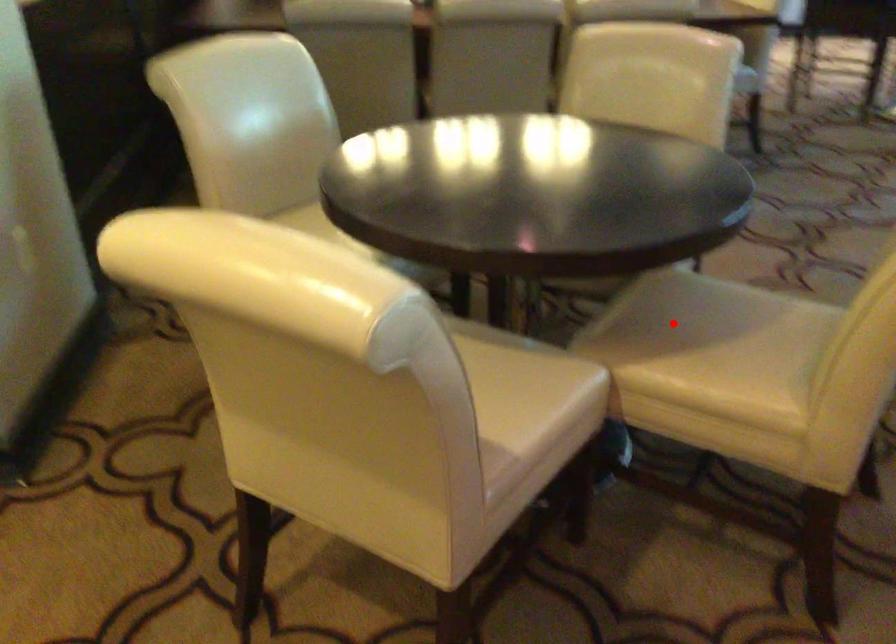
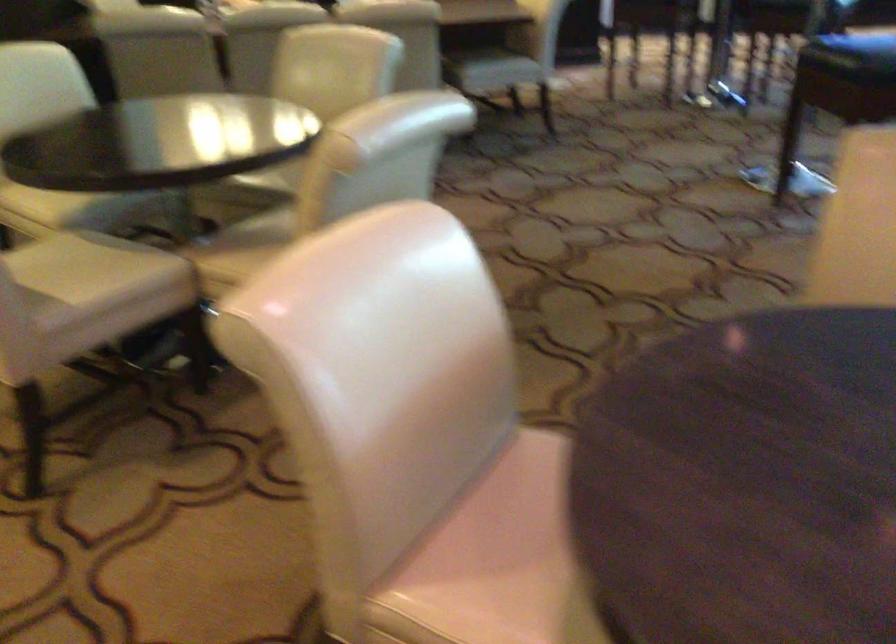
The point at the highlighted location is marked in the first image. Where is the corresponding point in the second image?

(259, 234)